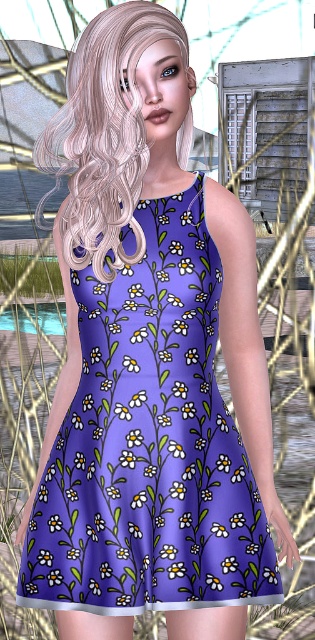
Question: Does purple floral dress at center have a lesser width compared to blondehair at center?

Choices:
 (A) no
 (B) yes

Answer: (A)

Question: Which object appears closest to the camera in this image?

Choices:
 (A) blondehair at center
 (B) purple floral dress at center

Answer: (A)

Question: Can you confirm if purple floral dress at center is positioned to the right of blondehair at center?

Choices:
 (A) no
 (B) yes

Answer: (B)

Question: Does purple floral dress at center have a smaller size compared to blondehair at center?

Choices:
 (A) no
 (B) yes

Answer: (B)

Question: Which point is farther to the camera?

Choices:
 (A) blondehair at center
 (B) purple floral dress at center

Answer: (B)